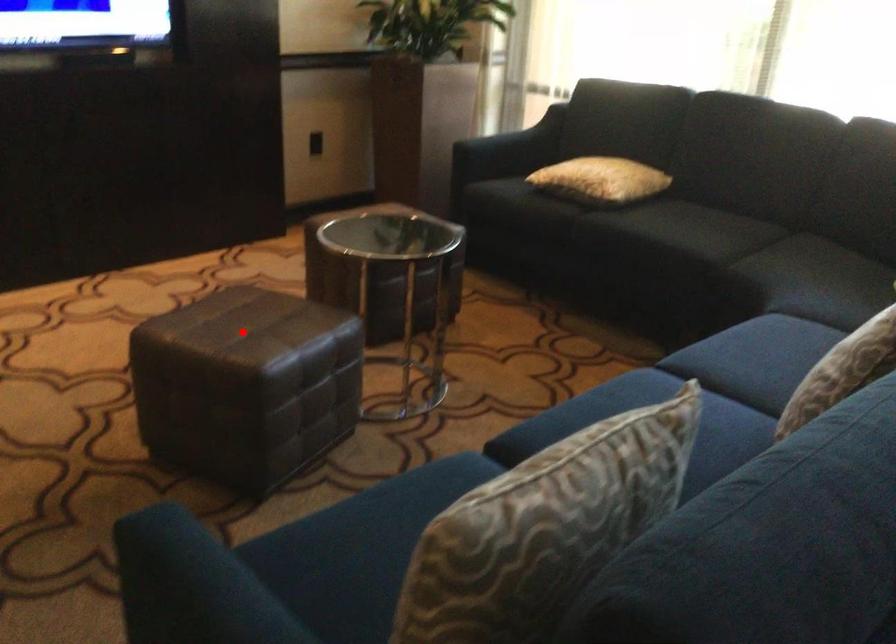
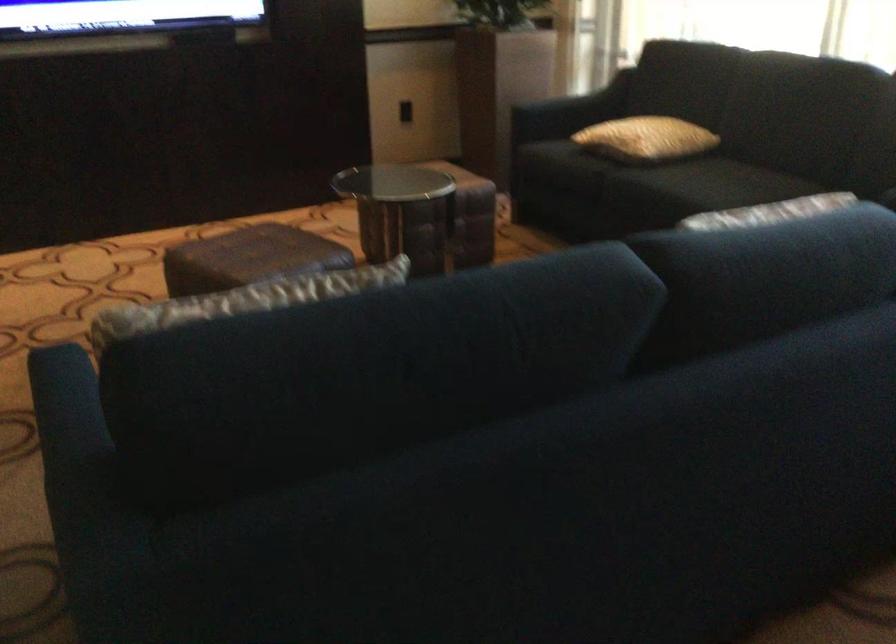
Find the pixel in the second image that matches the highlighted location in the first image.

(248, 258)